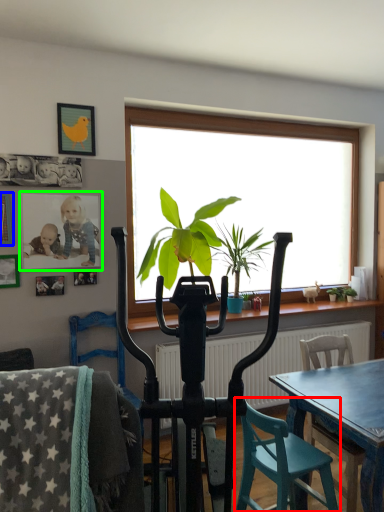
Question: Estimate the real-world distances between objects in this image. Which object is farther from chair (highlighted by a red box), picture frame (highlighted by a blue box) or picture frame (highlighted by a green box)?

Choices:
 (A) picture frame
 (B) picture frame

Answer: (A)